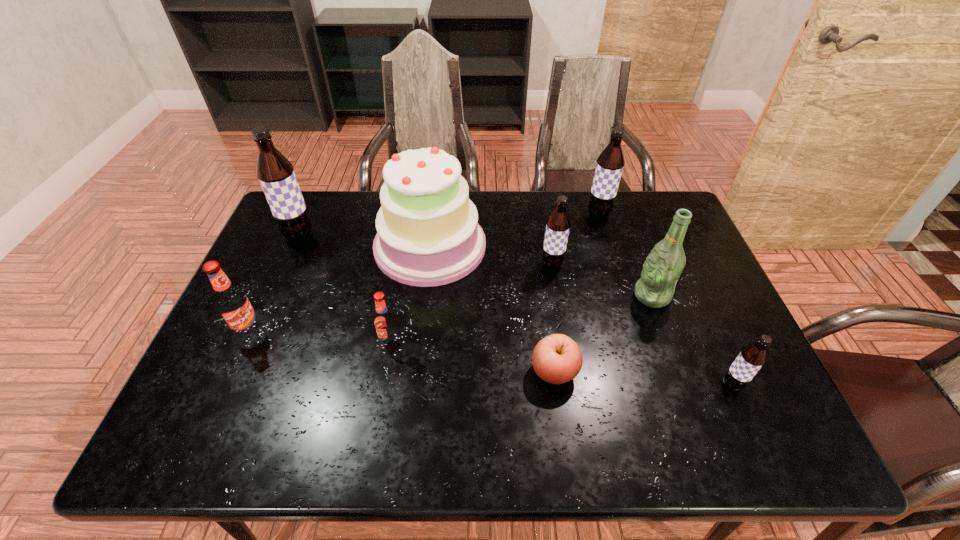
Locate an element on the screen. The width and height of the screenshot is (960, 540). the leftmost brown root beer is located at coordinates (275, 173).

Identify the location of the tallest root beer. (275, 173).

The height and width of the screenshot is (540, 960). What are the coordinates of `purple cake` in the screenshot? It's located at (428, 234).

At what (x,y) coordinates should I click in order to perform the action: click on the second biggest brown root beer. Please return your answer as a coordinate pair (x, y). Looking at the image, I should click on (610, 163).

Where is `the second brown root beer from right to left`? The image size is (960, 540). the second brown root beer from right to left is located at coordinates point(610,163).

Locate an element on the screen. The height and width of the screenshot is (540, 960). green beer bottle is located at coordinates (663, 266).

Where is `the left red root beer`? the left red root beer is located at coordinates (233, 304).

At what (x,y) coordinates should I click in order to perform the action: click on the third brown root beer from right to left. Please return your answer as a coordinate pair (x, y). Looking at the image, I should click on pyautogui.click(x=558, y=224).

Find the location of a particular element. the second nearest brown root beer is located at coordinates (558, 224).

Identify the location of the right red root beer. pos(384,320).